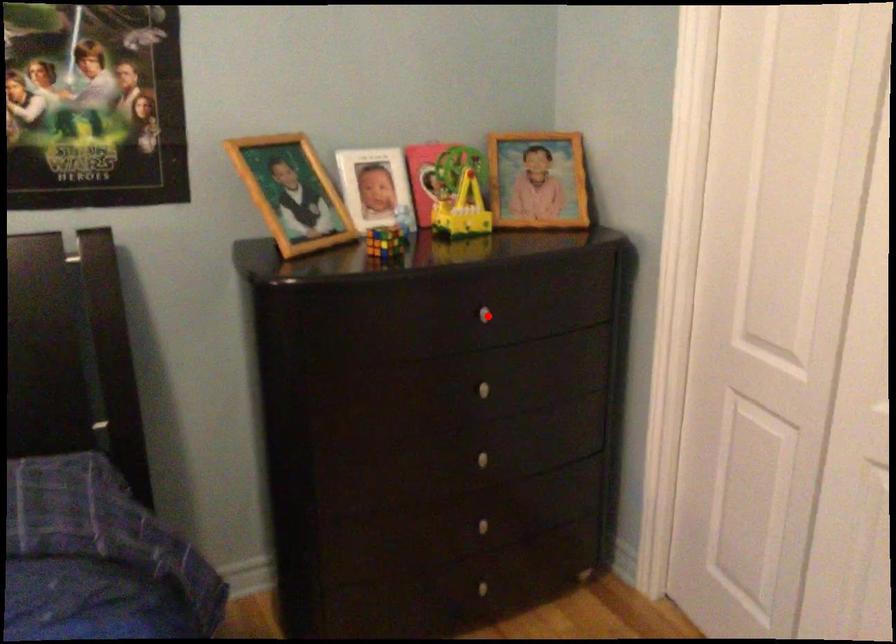
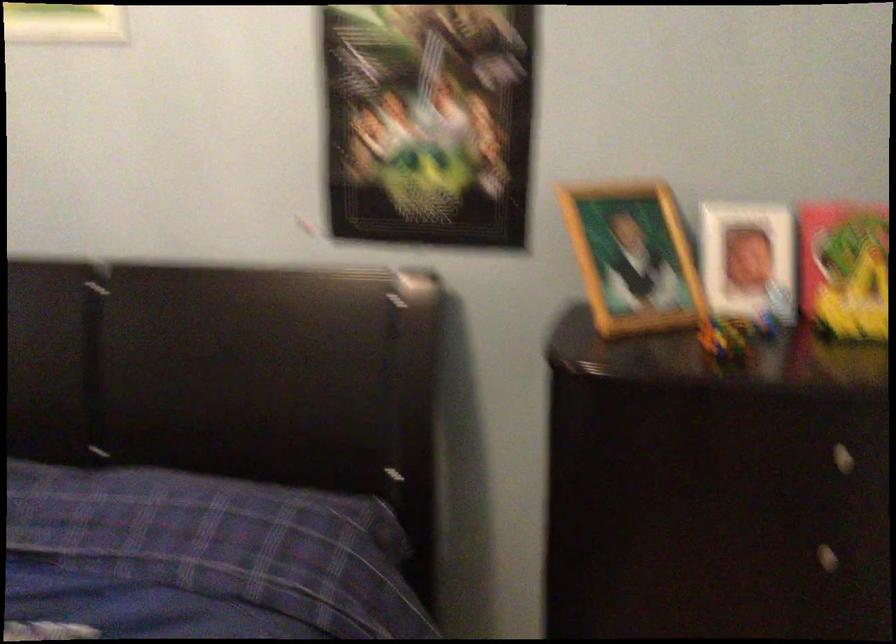
Question: I am providing you with two images of the same scene from different viewpoints. A red point is shown in image1. For the corresponding object point in image2, is it positioned nearer or farther from the camera?

Choices:
 (A) Nearer
 (B) Farther

Answer: (A)